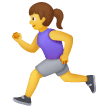
Find the location of `bottom drawers`. bottom drawers is located at coordinates (50, 66).